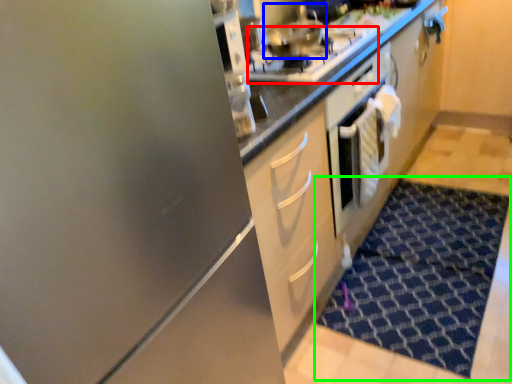
Question: Considering the real-world distances, which object is closest to gas stove (highlighted by a red box)? stainless steel (highlighted by a blue box) or doormat (highlighted by a green box).

Choices:
 (A) stainless steel
 (B) doormat

Answer: (A)